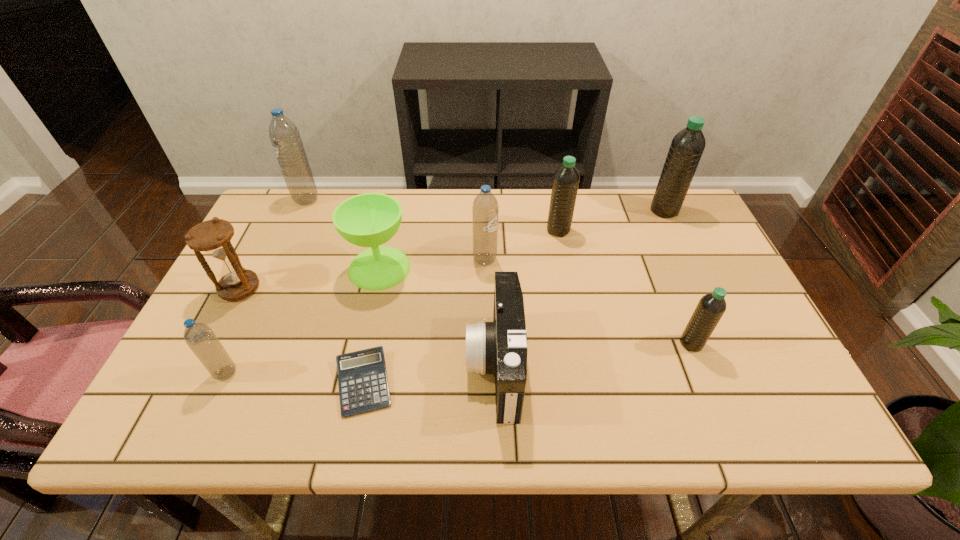
What are the coordinates of `the nearest black water bottle` in the screenshot? It's located at (711, 307).

Image resolution: width=960 pixels, height=540 pixels. Identify the location of the nearest blue water bottle. (199, 337).

At what (x,y) coordinates should I click in order to perform the action: click on the smallest blue water bottle. Please return your answer as a coordinate pair (x, y). Image resolution: width=960 pixels, height=540 pixels. Looking at the image, I should click on (199, 337).

What are the coordinates of `black camcorder` in the screenshot? It's located at (500, 347).

Image resolution: width=960 pixels, height=540 pixels. Identify the location of the shortest object. (362, 376).

You are a GUI agent. You are given a task and a screenshot of the screen. Output one action in this format:
    pyautogui.click(x=<x>, y=<y>)
    Task: Click on the vacant position located 0.160m on the left of the rightmost water bottle
    
    Given the screenshot: What is the action you would take?
    599,210

You are a GUI agent. You are given a task and a screenshot of the screen. Output one action in this format:
    pyautogui.click(x=<x>, y=<y>)
    Task: Click on the vacant space located 0.230m on the right of the farthest blue water bottle
    This screenshot has width=960, height=540.
    Given the screenshot: What is the action you would take?
    pyautogui.click(x=391, y=200)

Identify the location of free space located on the left of the third water bottle from right to left. This screenshot has height=540, width=960. (476, 230).

Where is `vacant space located 0.110m on the left of the third water bottle from left to right`? The image size is (960, 540). vacant space located 0.110m on the left of the third water bottle from left to right is located at coordinates (433, 260).

Locate an element on the screen. This screenshot has height=540, width=960. vacant space located on the back of the hourglass is located at coordinates pos(289,192).